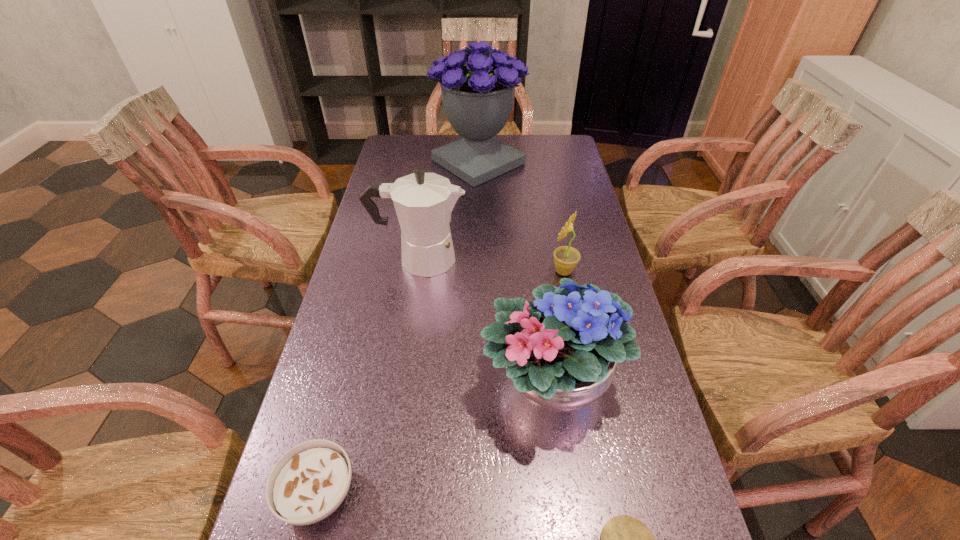
Locate an element on the screen. The image size is (960, 540). the fifth closest object to the shortest object is located at coordinates [478, 83].

You are a GUI agent. You are given a task and a screenshot of the screen. Output one action in this format:
    pyautogui.click(x=<x>, y=<y>)
    Task: Click on the free space that satisfies the following two spatial constraints: 1. at the spout of the coffeepot; 2. on the back side of the nearer bouquet
    
    Given the screenshot: What is the action you would take?
    pyautogui.click(x=402, y=380)

Find the location of a particular element. This screenshot has height=540, width=960. free space that satisfies the following two spatial constraints: 1. at the spout of the fifth shortest object; 2. on the front side of the soup bowl is located at coordinates (385, 494).

Locate an element on the screen. free space that satisfies the following two spatial constraints: 1. on the face of the fourth tallest object; 2. on the front side of the fourth shortest object is located at coordinates (585, 380).

Where is `free space that satisfies the following two spatial constraints: 1. at the spout of the coffeepot; 2. on the front side of the shortest object`? The height and width of the screenshot is (540, 960). free space that satisfies the following two spatial constraints: 1. at the spout of the coffeepot; 2. on the front side of the shortest object is located at coordinates (385, 494).

The width and height of the screenshot is (960, 540). What are the coordinates of `blank area in the image that satisfies the following two spatial constraints: 1. at the spout of the third nearest object; 2. on the left side of the coffeepot` in the screenshot? It's located at (402, 380).

Find the location of a particular element. Image resolution: width=960 pixels, height=540 pixels. vacant region that satisfies the following two spatial constraints: 1. on the back side of the soup bowl; 2. on the left side of the fourth shortest object is located at coordinates (347, 380).